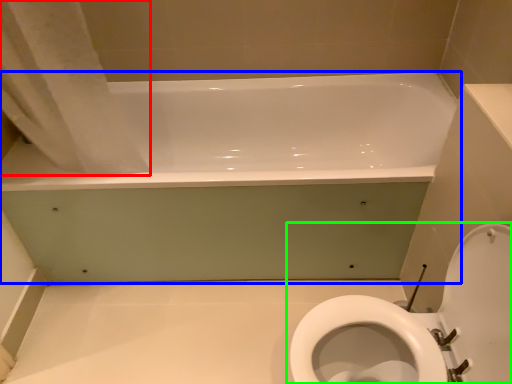
Question: Which object is the farthest from shower curtain (highlighted by a red box)? Choose among these: bathtub (highlighted by a blue box) or toilet (highlighted by a green box).

Choices:
 (A) bathtub
 (B) toilet

Answer: (B)